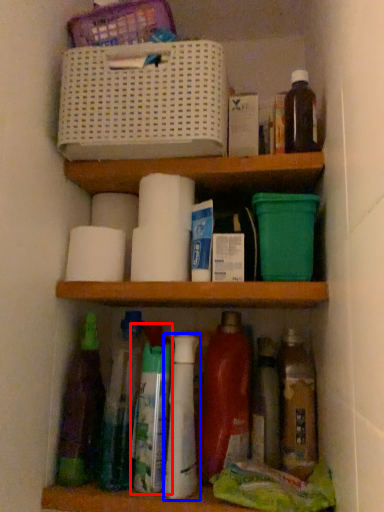
Question: Which object is closer to the camera taking this photo, bottle (highlighted by a red box) or bottle (highlighted by a blue box)?

Choices:
 (A) bottle
 (B) bottle

Answer: (B)